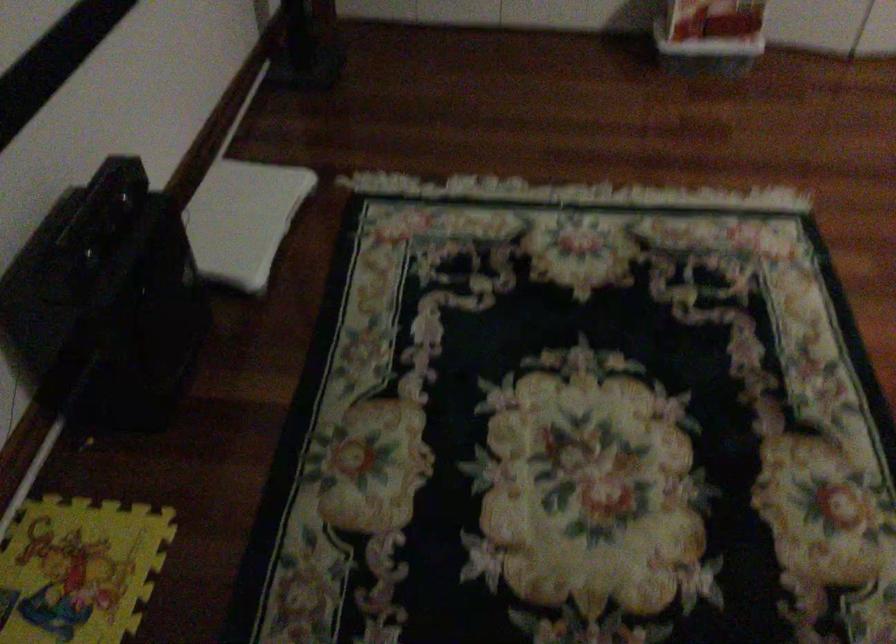
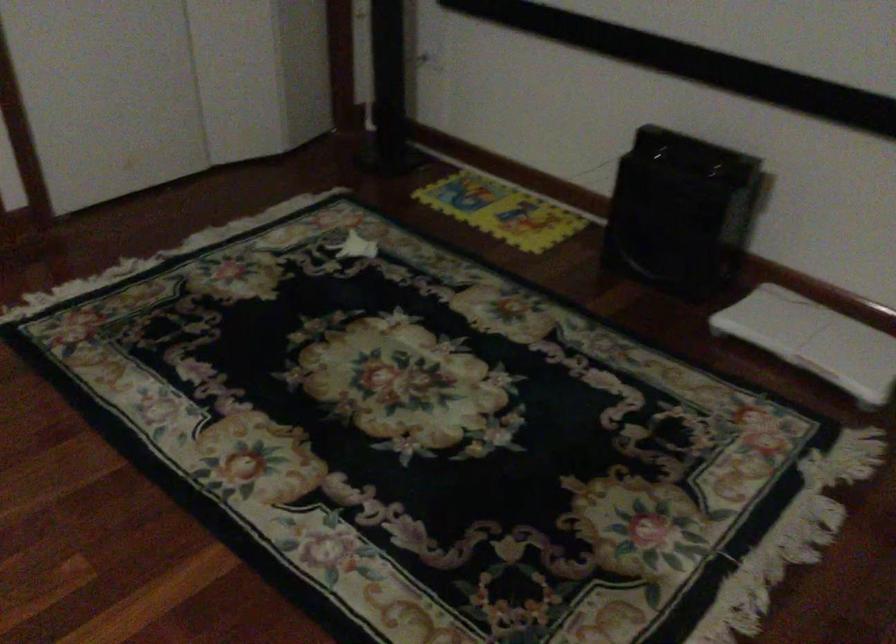
Find the pixel in the second image that matches point (260, 211) in the first image.

(814, 339)